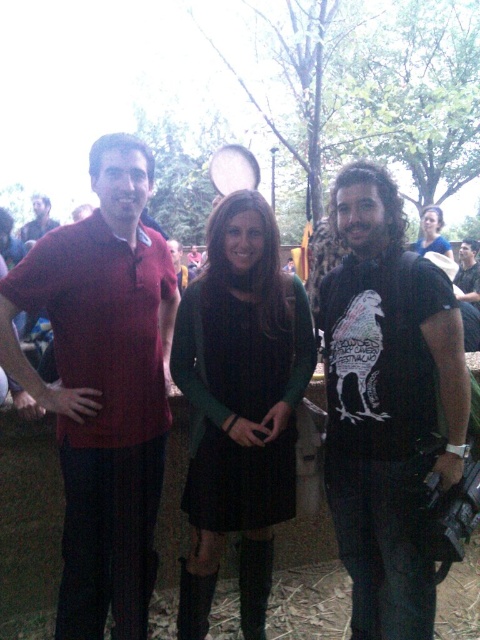
You are standing at the point with coordinates point (240, 406). Which object are you touching?

You are touching the matte green sweater at center.